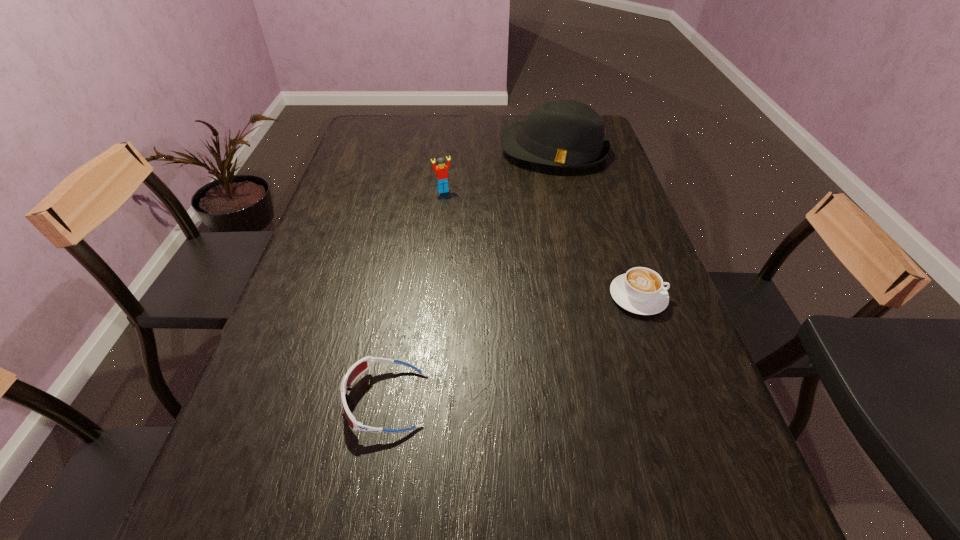
Identify the location of empty location between the tallest object and the second farthest object. (498, 170).

In order to click on free space between the fedora and the Lego in this screenshot , I will do `click(498, 170)`.

Image resolution: width=960 pixels, height=540 pixels. I want to click on vacant space that is in between the farthest object and the third farthest object, so click(596, 223).

Choose which object is the second nearest neighbor to the tallest object. Please provide its 2D coordinates. Your answer should be formatted as a tuple, i.e. [(x, y)], where the tuple contains the x and y coordinates of a point satisfying the conditions above.

[(640, 291)]

Point out which object is positioned as the third nearest to the cappuccino. Please provide its 2D coordinates. Your answer should be formatted as a tuple, i.e. [(x, y)], where the tuple contains the x and y coordinates of a point satisfying the conditions above.

[(441, 169)]